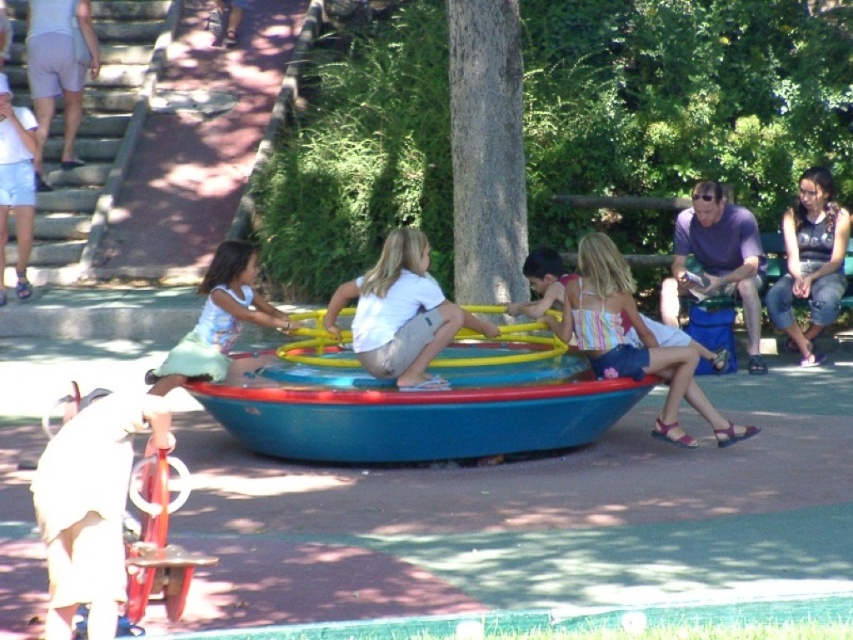
Image resolution: width=853 pixels, height=640 pixels. Find the location of `denim shorts at lower right`. denim shorts at lower right is located at coordinates (810, 260).

Is point (828, 212) farther from viewer compared to point (160, 394)?

Yes.

Find the location of `denim shorts at lower right`. denim shorts at lower right is located at coordinates (810, 260).

Between striped fabric dress at center and denim shorts at lower right, which one is positioned lower?

striped fabric dress at center is below.

Which is in front, point (566, 337) or point (833, 220)?

Point (566, 337) is in front.

You are a GUI agent. You are given a task and a screenshot of the screen. Output one action in this format:
    pyautogui.click(x=<x>, y=<y>)
    Task: Click on the striped fabric dress at center
    The width and height of the screenshot is (853, 640).
    Given the screenshot: What is the action you would take?
    pyautogui.click(x=630, y=344)

Is white cotton shirt at center bigger than denim shorts at lower right?

Incorrect, white cotton shirt at center is not larger than denim shorts at lower right.

Does white cotton shirt at center come behind denim shorts at lower right?

No, white cotton shirt at center is closer to the viewer.

Which is in front, point (469, 326) or point (834, 234)?

Point (469, 326) is in front.

Identify the location of white cotton shirt at center. (401, 314).